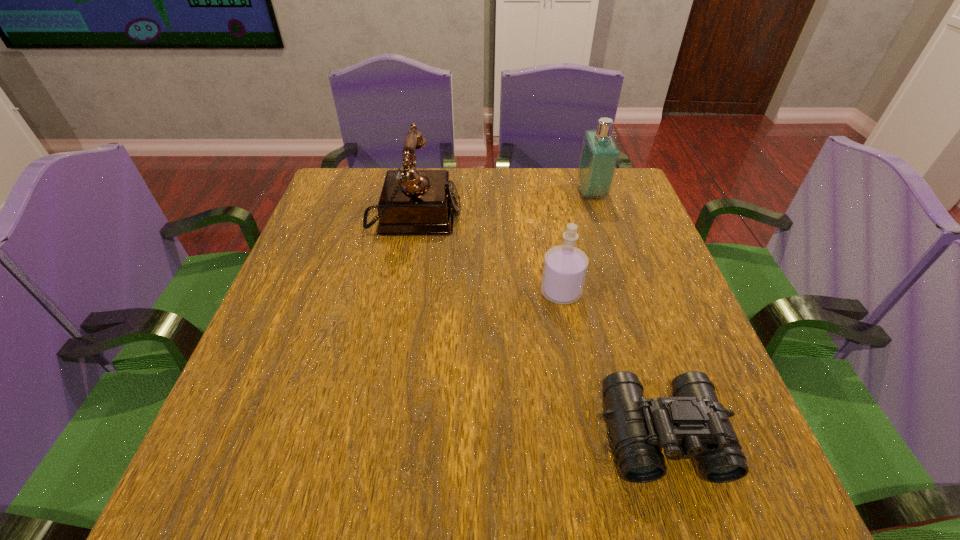
Where is `free space located 0.340m on the dial of the leftmost object`? Image resolution: width=960 pixels, height=540 pixels. free space located 0.340m on the dial of the leftmost object is located at coordinates (588, 218).

This screenshot has height=540, width=960. Identify the location of free region located on the back of the left perfume. (556, 264).

I want to click on perfume that is at the far edge, so click(600, 153).

Find the location of a particular element. This screenshot has height=540, width=960. telephone at the far edge is located at coordinates (413, 202).

Where is `object that is at the near edge`? The width and height of the screenshot is (960, 540). object that is at the near edge is located at coordinates (692, 424).

Identify the location of object positioned at the left edge. The width and height of the screenshot is (960, 540). (413, 202).

Find the location of `perfume that is at the right edge`. perfume that is at the right edge is located at coordinates (600, 153).

At what (x,y) coordinates should I click in order to perform the action: click on binoculars positioned at the right edge. Please return your answer as a coordinate pair (x, y). Looking at the image, I should click on (692, 424).

I want to click on object present at the far left corner, so click(413, 202).

Identify the location of object situated at the far right corner. (600, 153).